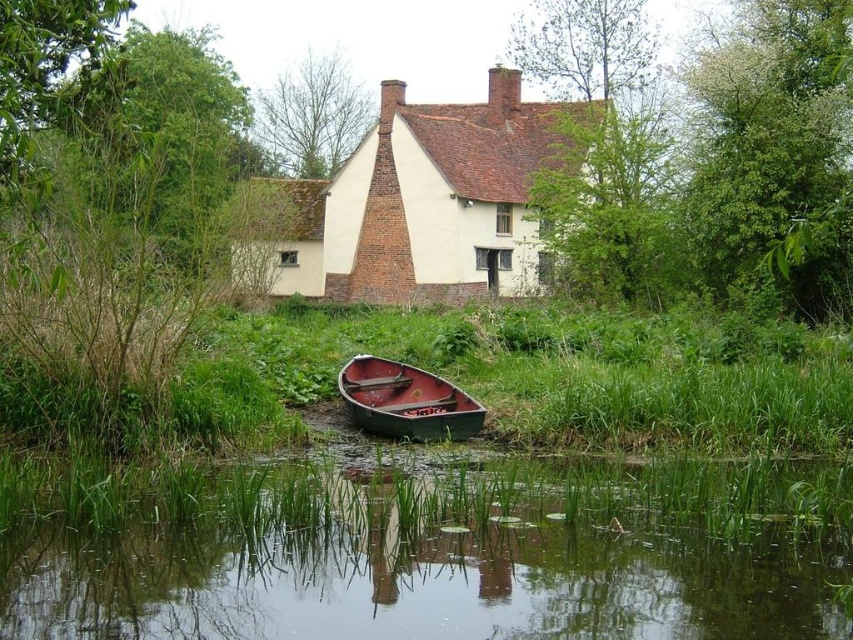
Between point (192, 422) and point (431, 422), which one is positioned in front?

Positioned in front is point (192, 422).

Is point (502, 324) farther from camera compared to point (376, 369)?

Yes, point (502, 324) is behind point (376, 369).

Is point (700, 337) farther from viewer compared to point (380, 365)?

Yes, it is behind point (380, 365).

Find the location of `green grassy at lower center`. green grassy at lower center is located at coordinates (549, 372).

What do you see at coordinates (434, 570) in the screenshot? I see `green grassy river at lower center` at bounding box center [434, 570].

This screenshot has width=853, height=640. I want to click on green grassy river at lower center, so click(434, 570).

At what (x,y) coordinates should I click in order to perform the action: click on green grassy river at lower center. Please return your answer as a coordinate pair (x, y). Looking at the image, I should click on (434, 570).

The height and width of the screenshot is (640, 853). What do you see at coordinates (434, 570) in the screenshot? I see `green grassy river at lower center` at bounding box center [434, 570].

Is point (775, 561) positioned in front of point (495, 90)?

That is True.

I want to click on green grassy river at lower center, so click(434, 570).